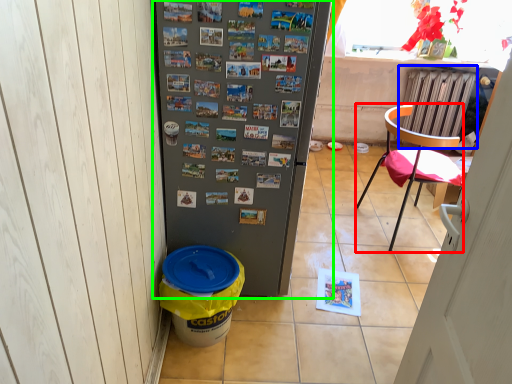
Question: Which is farther away from chair (highlighted by a red box)? radiator (highlighted by a blue box) or refrigerator (highlighted by a green box)?

Choices:
 (A) radiator
 (B) refrigerator

Answer: (B)